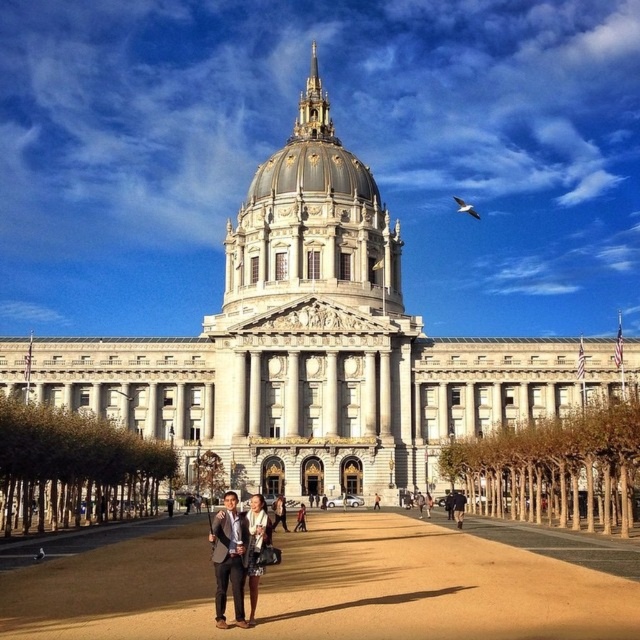
Question: Does gold/gilded dome at center appear over dark gray suit at center?

Choices:
 (A) no
 (B) yes

Answer: (B)

Question: Which of the following is the farthest from the observer?

Choices:
 (A) 301,188
 (B) 342,172
 (C) 362,564
 (D) 236,529

Answer: (B)

Question: Can you confirm if brown sand at center is positioned above gold/gilded dome at center?

Choices:
 (A) yes
 (B) no

Answer: (B)

Question: Does matte black dress at lower center have a greater width compared to dark gray suit at center?

Choices:
 (A) yes
 (B) no

Answer: (A)

Question: Which object is farther from the camera taking this photo?

Choices:
 (A) dark gray suit at center
 (B) matte black dress at lower center

Answer: (A)

Question: Estimate the real-world distances between objects in this image. Which object is farther from the gold/gilded dome at center?

Choices:
 (A) matte black suit at center
 (B) white marble building at center

Answer: (A)